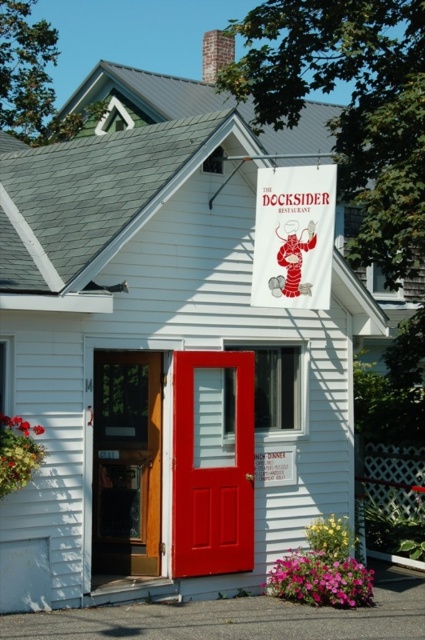
Question: Is matte red door at center below white fabric sign at upper center?

Choices:
 (A) yes
 (B) no

Answer: (A)

Question: Which point is farther from the camera taking this photo?

Choices:
 (A) click(x=136, y=557)
 (B) click(x=180, y=369)

Answer: (A)

Question: Which point appears farthest from the camera in this image?

Choices:
 (A) (325, 166)
 (B) (121, 449)

Answer: (B)

Question: Estimate the real-world distances between objects in this image. Which object is farther from the wooden door at center?

Choices:
 (A) matte red door at center
 (B) white fabric sign at upper center

Answer: (B)

Question: Is matte red door at center thinner than white fabric sign at upper center?

Choices:
 (A) yes
 (B) no

Answer: (A)

Question: Can you confirm if wooden door at center is smaller than white fabric sign at upper center?

Choices:
 (A) no
 (B) yes

Answer: (B)